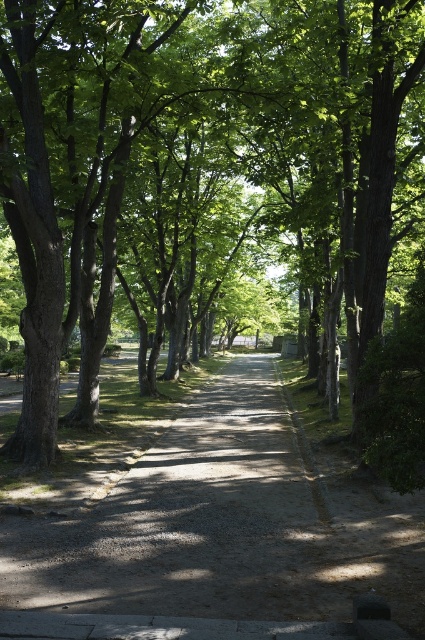
Question: Which point is farther to the camera?

Choices:
 (A) dirt/gravel path at center
 (B) green leafy tree at center

Answer: (B)

Question: Is green leafy tree at center smaller than dirt/gravel path at center?

Choices:
 (A) no
 (B) yes

Answer: (A)

Question: Does green leafy tree at center have a greater width compared to dirt/gravel path at center?

Choices:
 (A) no
 (B) yes

Answer: (B)

Question: From the image, what is the correct spatial relationship of green leafy tree at center in relation to dirt/gravel path at center?

Choices:
 (A) below
 (B) above

Answer: (B)